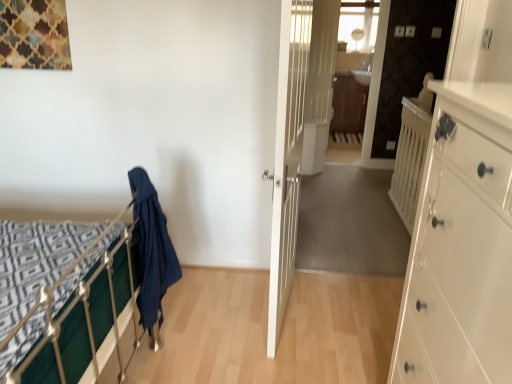
Question: Does white wooden door at center, which is the second door in back-to-front order, have a larger size compared to dark blue fabric at left?

Choices:
 (A) yes
 (B) no

Answer: (A)

Question: From the image's perspective, is white wooden door at center, which appears as the 1th door when viewed from the left, on top of dark blue fabric at left?

Choices:
 (A) yes
 (B) no

Answer: (A)

Question: Considering the relative sizes of white wooden door at center, which appears as the 1th door when viewed from the left, and dark blue fabric at left in the image provided, is white wooden door at center, which appears as the 1th door when viewed from the left, shorter than dark blue fabric at left?

Choices:
 (A) no
 (B) yes

Answer: (A)

Question: Is white wooden door at center, which appears as the 1th door when viewed from the left, oriented towards dark blue fabric at left?

Choices:
 (A) yes
 (B) no

Answer: (B)

Question: Does white wooden door at center, which appears as the 1th door when viewed from the left, appear on the left side of dark blue fabric at left?

Choices:
 (A) no
 (B) yes

Answer: (A)

Question: From the image's perspective, is white wooden door at center, positioned as the 1th door in front-to-back order, below dark blue fabric at left?

Choices:
 (A) yes
 (B) no

Answer: (B)

Question: Is white glossy door at center, the second door when ordered from front to back, touching brown wood/file cabinet at center?

Choices:
 (A) yes
 (B) no

Answer: (B)

Question: Does white glossy door at center, marked as the 1th door in a back-to-front arrangement, appear on the right side of brown wood/file cabinet at center?

Choices:
 (A) no
 (B) yes

Answer: (A)

Question: Considering the relative sizes of white glossy door at center, the second door when ordered from front to back, and brown wood/file cabinet at center in the image provided, is white glossy door at center, the second door when ordered from front to back, bigger than brown wood/file cabinet at center?

Choices:
 (A) yes
 (B) no

Answer: (B)

Question: From the image's perspective, is white glossy door at center, the second door when ordered from front to back, on top of brown wood/file cabinet at center?

Choices:
 (A) no
 (B) yes

Answer: (B)

Question: From the image's perspective, is white glossy door at center, the 1th door when ordered from right to left, beneath brown wood/file cabinet at center?

Choices:
 (A) yes
 (B) no

Answer: (B)

Question: Is white glossy door at center, the 1th door when ordered from right to left, not within brown wood/file cabinet at center?

Choices:
 (A) no
 (B) yes

Answer: (B)

Question: From a real-world perspective, is brown wood/file cabinet at center below white wooden door at center, which appears as the 1th door when viewed from the left?

Choices:
 (A) no
 (B) yes

Answer: (B)